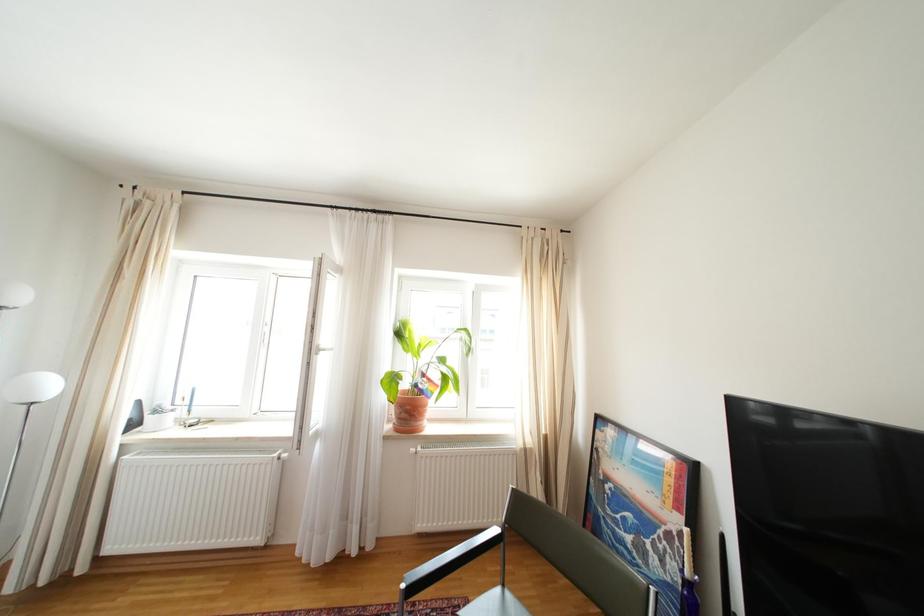
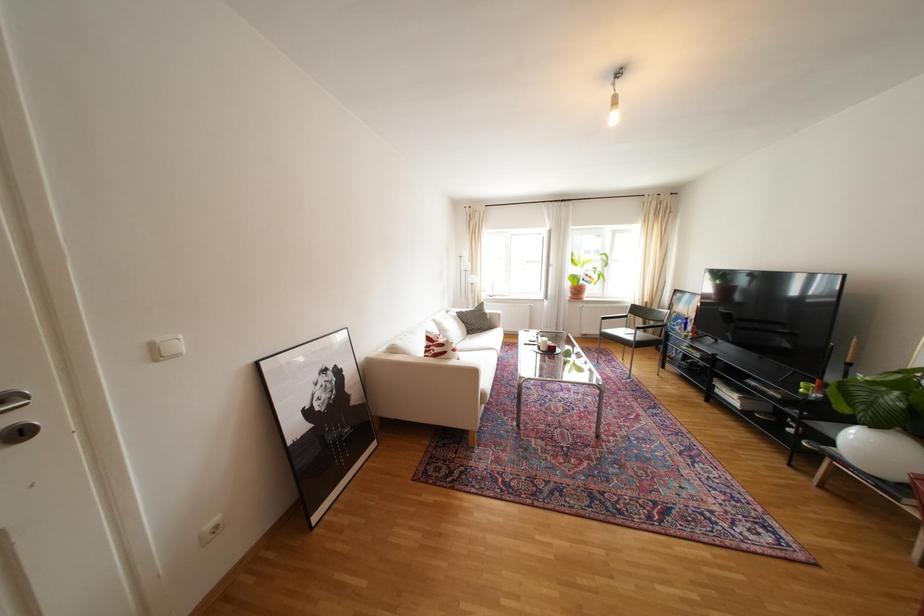
Question: The images are taken continuously from a first-person perspective. In which direction are you moving?

Choices:
 (A) Left
 (B) Right
 (C) Forward
 (D) Backward

Answer: (D)